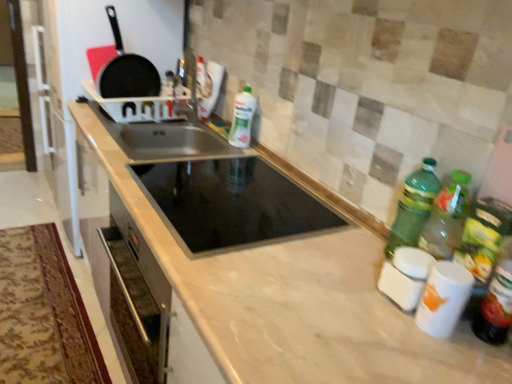
The width and height of the screenshot is (512, 384). I want to click on vacant area in front of white glossy canisters at lower right, so click(x=438, y=356).